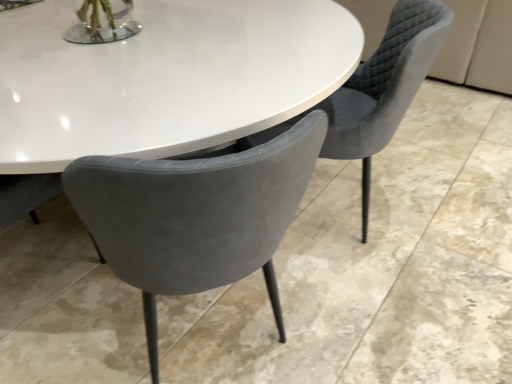
This screenshot has width=512, height=384. In order to click on free location to the right of velvet grey chair at center, arranged as the 2th chair when viewed from the left in this screenshot , I will do `click(445, 199)`.